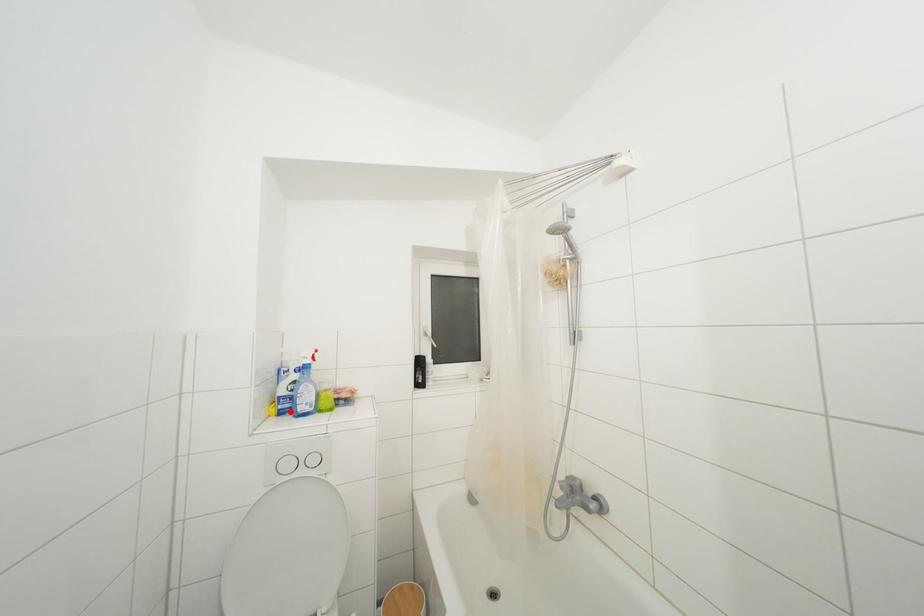
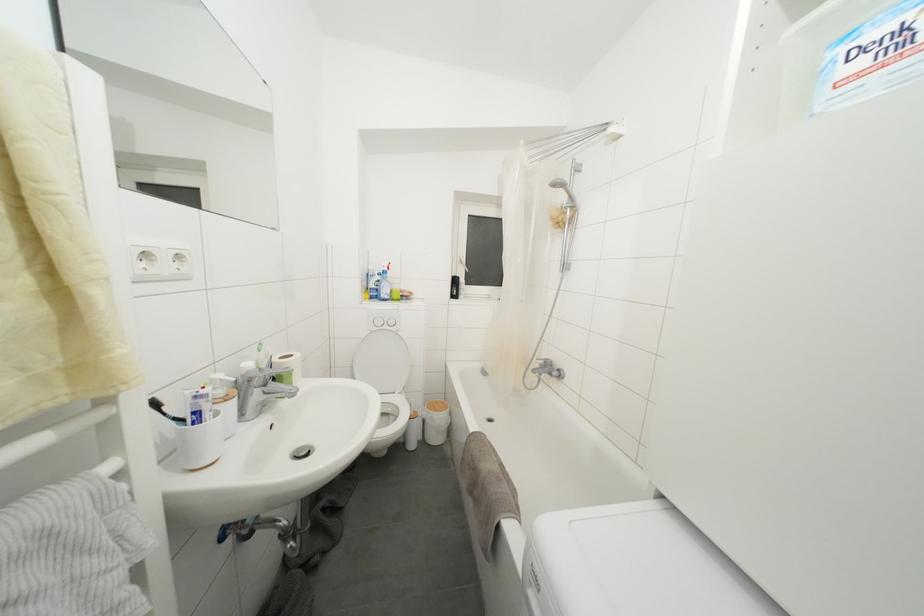
In the second image, find the point that corresponds to the highlighted location in the first image.

(379, 300)